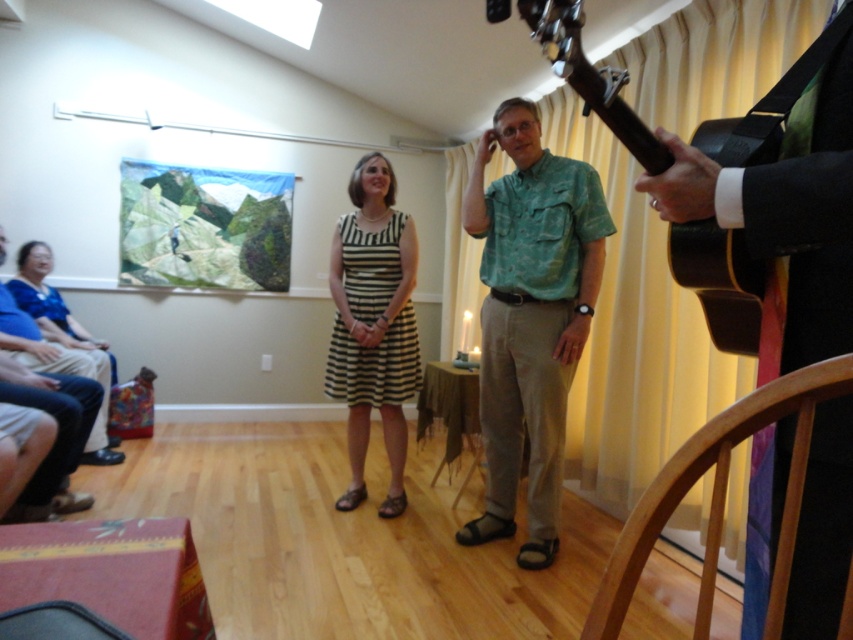
At what (x,y) coordinates should I click in order to perform the action: click on green textured shirt at center. Please return your answer as a coordinate pair (x, y). The width and height of the screenshot is (853, 640). Looking at the image, I should click on (531, 316).

Is point (584, 292) positioned behind point (349, 320)?

No, (584, 292) is in front of (349, 320).

This screenshot has width=853, height=640. Find the location of `green textured shirt at center`. green textured shirt at center is located at coordinates click(531, 316).

Is striped fabric dress at center above matte blue dress at left?

Yes, striped fabric dress at center is above matte blue dress at left.

Can you confirm if striped fabric dress at center is positioned to the right of matte blue dress at left?

Indeed, striped fabric dress at center is positioned on the right side of matte blue dress at left.

Is point (390, 356) farther from camera compared to point (45, 371)?

No, it is not.

Identify the location of striped fabric dress at center. The image size is (853, 640). (373, 324).

Who is more forward, [834,477] or [490,253]?

Positioned in front is point [834,477].

Can you confirm if shiny black guitar at center is thinner than green textured shirt at center?

Yes, shiny black guitar at center is thinner than green textured shirt at center.

Describe the element at coordinates (787, 205) in the screenshot. I see `shiny black guitar at center` at that location.

Where is `shiny black guitar at center`? The image size is (853, 640). shiny black guitar at center is located at coordinates (787, 205).